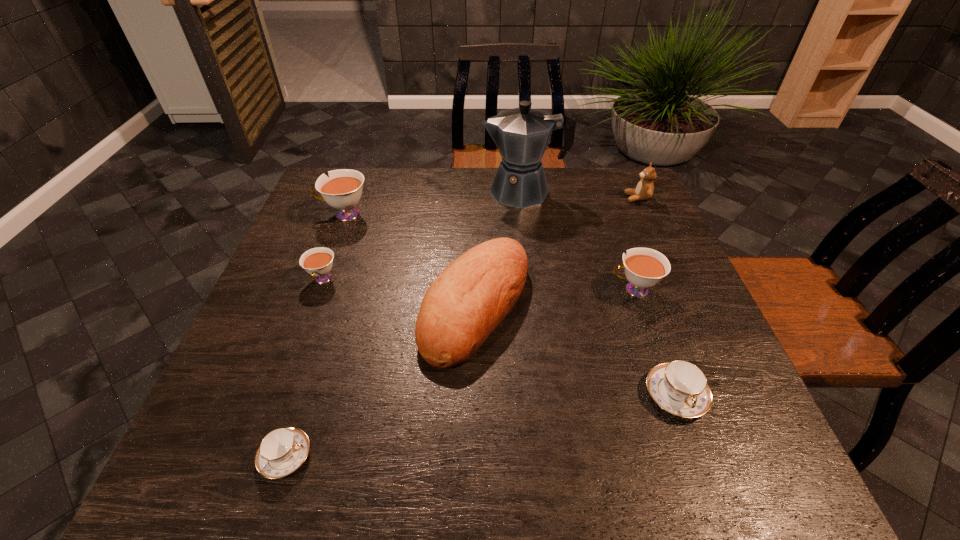
The height and width of the screenshot is (540, 960). I want to click on free point between the smallest white teacup and the coffeepot, so click(x=423, y=236).

The height and width of the screenshot is (540, 960). In order to click on empty space that is in between the fourth shortest teacup and the rightmost object in this screenshot , I will do `click(636, 244)`.

You are a GUI agent. You are given a task and a screenshot of the screen. Output one action in this format:
    pyautogui.click(x=<x>, y=<y>)
    Task: Click on the blank region between the tallest object and the teddy bear
    
    Given the screenshot: What is the action you would take?
    pyautogui.click(x=581, y=195)

The width and height of the screenshot is (960, 540). Find the location of `free space between the tallest object and the rightmost white teacup`. free space between the tallest object and the rightmost white teacup is located at coordinates (579, 241).

What are the coordinates of `free point between the smallest white teacup and the bigger blue teacup` in the screenshot? It's located at (499, 338).

The image size is (960, 540). Identify the location of unoccupied area between the farthest white teacup and the smallest white teacup. point(334,247).

I want to click on vacant region between the shortest teacup and the rightmost white teacup, so click(x=460, y=373).

At what (x,y) coordinates should I click in order to perform the action: click on free space between the smaller blue teacup and the fourth shortest teacup. Please return your answer as a coordinate pair (x, y). Looking at the image, I should click on (460, 373).

Locate an element on the screen. object that is the third closest one to the light bread is located at coordinates pos(282,451).

In order to click on the seventh closest object to the coffeepot in this screenshot , I will do point(282,451).